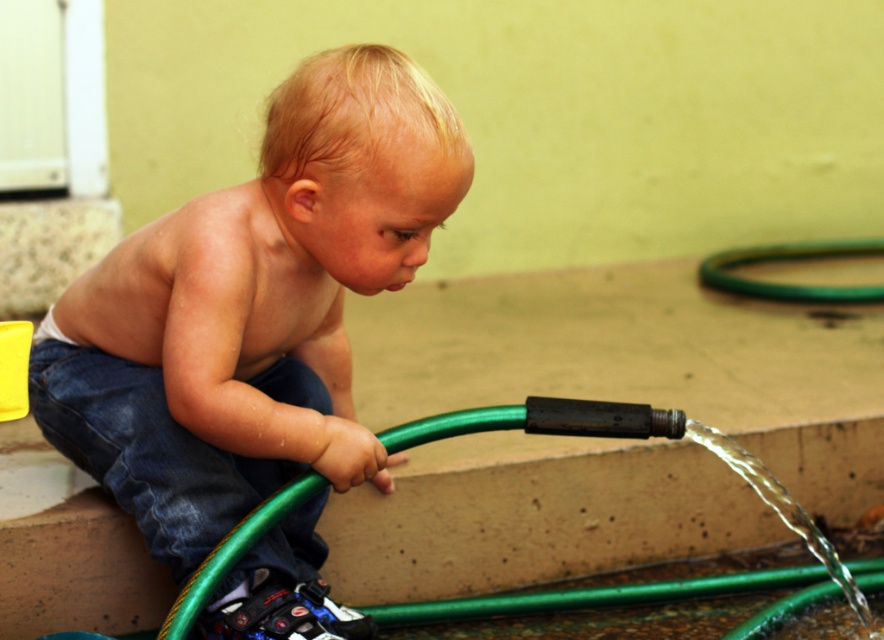
Can you confirm if smooth denim jeans at left is taller than green rubber hose at lower right?

Indeed, smooth denim jeans at left has a greater height compared to green rubber hose at lower right.

Is smooth denim jeans at left above green rubber hose at lower right?

Actually, smooth denim jeans at left is below green rubber hose at lower right.

Where is `smooth denim jeans at left`? Image resolution: width=884 pixels, height=640 pixels. smooth denim jeans at left is located at coordinates (252, 308).

At what (x,y) coordinates should I click in order to perform the action: click on smooth denim jeans at left. Please return your answer as a coordinate pair (x, y). Looking at the image, I should click on (252, 308).

Can you confirm if denim at left is bigger than green rubber hose at lower right?

Incorrect, denim at left is not larger than green rubber hose at lower right.

Who is positioned more to the right, denim at left or green rubber hose at lower right?

green rubber hose at lower right is more to the right.

Locate an element on the screen. The image size is (884, 640). denim at left is located at coordinates (145, 451).

Does smooth denim jeans at left have a lesser width compared to denim at left?

No, smooth denim jeans at left is not thinner than denim at left.

Does smooth denim jeans at left have a lesser height compared to denim at left?

Incorrect, smooth denim jeans at left's height does not fall short of denim at left's.

Does point (282, 483) come behind point (254, 484)?

Yes, it is.

Where is `smooth denim jeans at left`? smooth denim jeans at left is located at coordinates (252, 308).